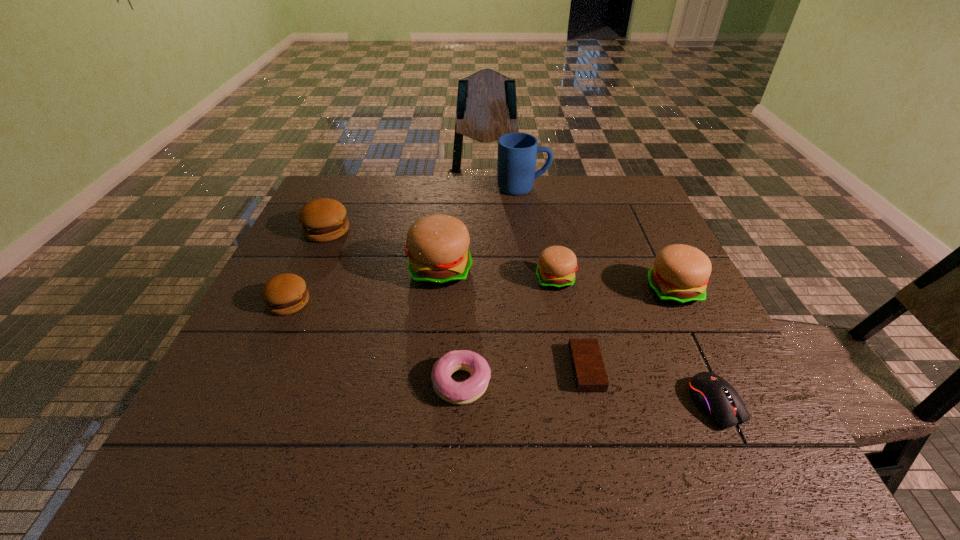
At what (x,y) coordinates should I click in order to perform the action: click on the closest hamburger to the farthest hamburger. Please return your answer as a coordinate pair (x, y). Image resolution: width=960 pixels, height=540 pixels. Looking at the image, I should click on [284, 294].

Locate which beige hamburger is the second closest to the second beige hamburger from right to left. Please provide its 2D coordinates. Your answer should be formatted as a tuple, i.e. [(x, y)], where the tuple contains the x and y coordinates of a point satisfying the conditions above.

[(680, 274)]

Identify the location of beige hamburger that can be found as the third closest to the pink doughnut. The width and height of the screenshot is (960, 540). (680, 274).

You are a GUI agent. You are given a task and a screenshot of the screen. Output one action in this format:
    pyautogui.click(x=<x>, y=<y>)
    Task: Click on the vacant area that satisfies the following two spatial constraints: 1. on the side of the mug with the handle; 2. on the front side of the tallest hamburger
    The width and height of the screenshot is (960, 540).
    Given the screenshot: What is the action you would take?
    pyautogui.click(x=536, y=271)

Where is `blank area in the image that satisfies the following two spatial constraints: 1. on the back side of the nearer brown hamburger; 2. on the left side of the eighth nearest object`? This screenshot has height=540, width=960. blank area in the image that satisfies the following two spatial constraints: 1. on the back side of the nearer brown hamburger; 2. on the left side of the eighth nearest object is located at coordinates (323, 231).

Identify the location of vacant region that satisfies the following two spatial constraints: 1. on the front face of the alarm clock; 2. on the right side of the black computer mouse. (594, 404).